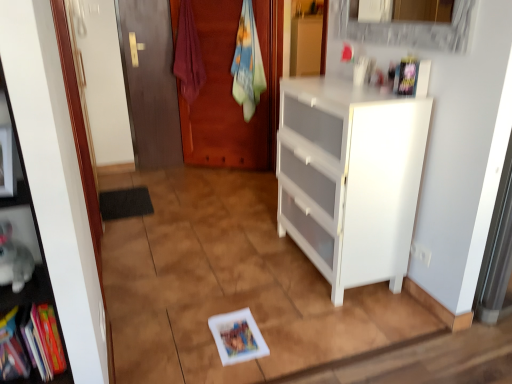
Find the location of `vacant space underneath matte red towel at center, which is counted as the first laundry, starting from the left (from a real-world perspective)`. vacant space underneath matte red towel at center, which is counted as the first laundry, starting from the left (from a real-world perspective) is located at coordinates (197, 168).